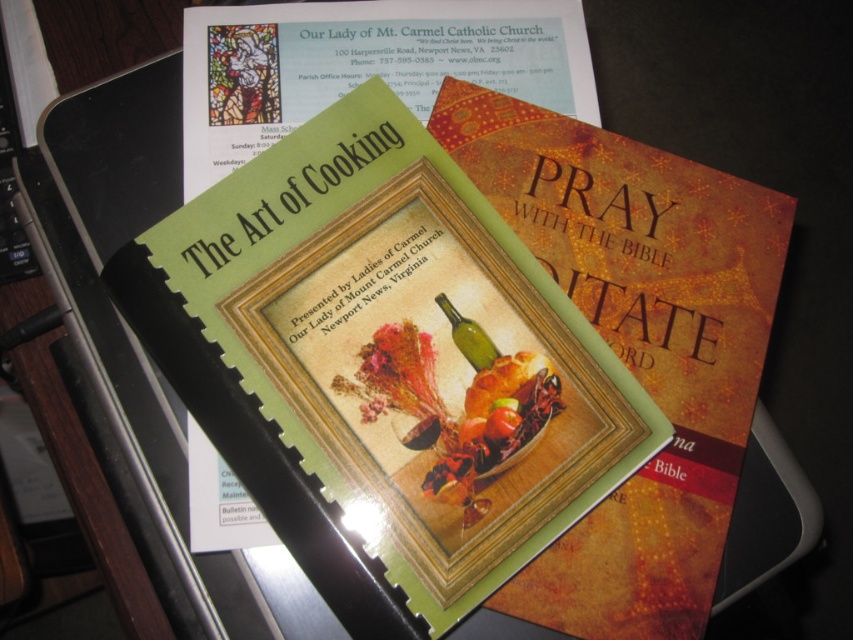
Locate an element on the screen. This screenshot has width=853, height=640. matte orange book at center is located at coordinates (637, 348).

Who is lower down, matte orange book at center or green glass wine bottle at center?

green glass wine bottle at center is below.

Is point (527, 145) closer to camera compared to point (480, 353)?

No, (527, 145) is behind (480, 353).

Where is `matte orange book at center`? matte orange book at center is located at coordinates (637, 348).

In the scene shown: Is green glass wine bottle at center to the right of red matte tomato at center from the viewer's perspective?

Incorrect, green glass wine bottle at center is not on the right side of red matte tomato at center.

Which of these two, green glass wine bottle at center or red matte tomato at center, stands taller?

With more height is green glass wine bottle at center.

Who is more distant from viewer, (456, 333) or (503, 417)?

The point (456, 333) is more distant.

Identify the location of green glass wine bottle at center. This screenshot has width=853, height=640. (468, 337).

Is green matte paper at center below green glass wine bottle at center?

Correct, green matte paper at center is located below green glass wine bottle at center.

Image resolution: width=853 pixels, height=640 pixels. Find the location of `green matte paper at center`. green matte paper at center is located at coordinates click(x=384, y=362).